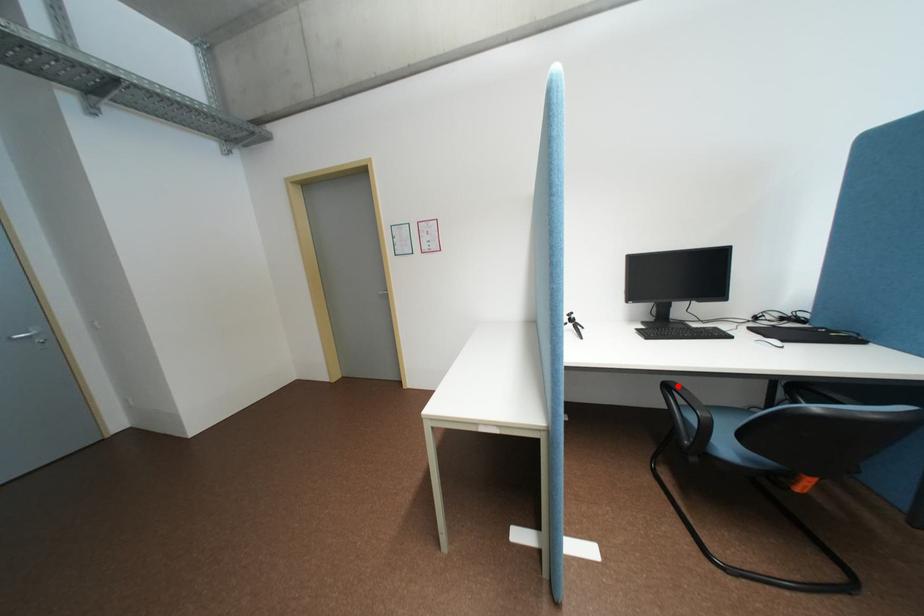
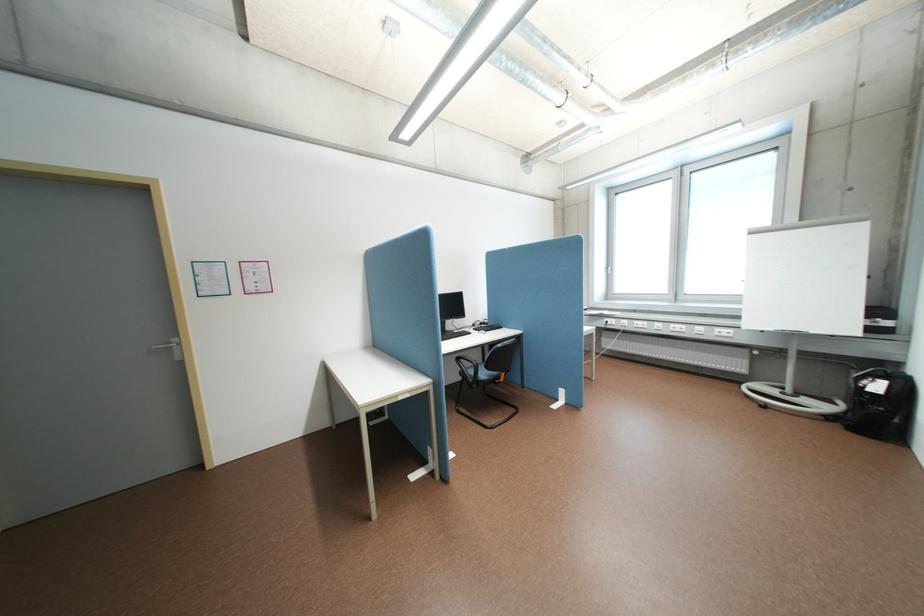
In the second image, find the point that corresponds to the highlighted location in the first image.

(468, 359)